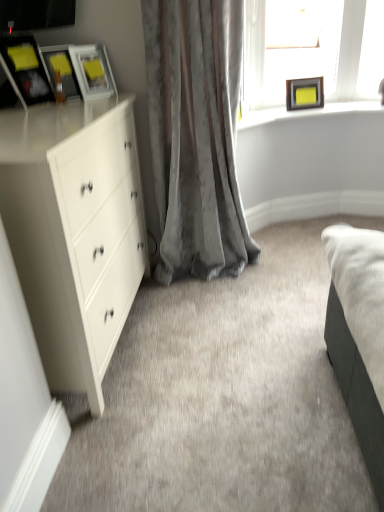
Question: Is matte wooden frame at upper right positioned before clear glass frame at upper right?

Choices:
 (A) yes
 (B) no

Answer: (B)

Question: From the image's perspective, would you say matte wooden frame at upper right is positioned over clear glass frame at upper right?

Choices:
 (A) no
 (B) yes

Answer: (A)

Question: Is matte wooden frame at upper right oriented away from clear glass frame at upper right?

Choices:
 (A) no
 (B) yes

Answer: (B)

Question: From the image's perspective, is matte wooden frame at upper right below clear glass frame at upper right?

Choices:
 (A) no
 (B) yes

Answer: (B)

Question: Does matte wooden frame at upper right have a greater height compared to clear glass frame at upper right?

Choices:
 (A) no
 (B) yes

Answer: (A)

Question: Relative to matte wooden frame at upper right, is matte black picture frame at upper left, which ranks as the first picture frame in left-to-right order, in front or behind?

Choices:
 (A) front
 (B) behind

Answer: (A)

Question: Based on their sizes in the image, would you say matte black picture frame at upper left, which appears as the fourth picture frame when viewed from the right, is bigger or smaller than matte wooden frame at upper right?

Choices:
 (A) big
 (B) small

Answer: (A)

Question: From a real-world perspective, is matte black picture frame at upper left, which ranks as the 4th picture frame in back-to-front order, positioned above or below matte wooden frame at upper right?

Choices:
 (A) above
 (B) below

Answer: (A)

Question: Do you think matte black picture frame at upper left, which ranks as the 4th picture frame in back-to-front order, is within matte wooden frame at upper right, or outside of it?

Choices:
 (A) inside
 (B) outside

Answer: (B)

Question: Is clear glass frame at upper right bigger or smaller than matte black picture frame at upper left, which is the third picture frame in back-to-front order?

Choices:
 (A) big
 (B) small

Answer: (A)

Question: In terms of width, does clear glass frame at upper right look wider or thinner when compared to matte black picture frame at upper left, marked as the third picture frame in a right-to-left arrangement?

Choices:
 (A) wide
 (B) thin

Answer: (B)

Question: From a real-world perspective, is clear glass frame at upper right positioned above or below matte black picture frame at upper left, which is the third picture frame in back-to-front order?

Choices:
 (A) above
 (B) below

Answer: (B)

Question: Relative to matte black picture frame at upper left, acting as the second picture frame starting from the left, is clear glass frame at upper right in front or behind?

Choices:
 (A) front
 (B) behind

Answer: (B)

Question: From a real-world perspective, is matte black picture frame at upper left, which ranks as the first picture frame in left-to-right order, physically located above or below matte black picture frame at upper left, which is the 2th picture frame in front-to-back order?

Choices:
 (A) above
 (B) below

Answer: (A)

Question: In the image, is matte black picture frame at upper left, which appears as the fourth picture frame when viewed from the right, on the left side or the right side of matte black picture frame at upper left, which is the 2th picture frame in front-to-back order?

Choices:
 (A) right
 (B) left

Answer: (B)